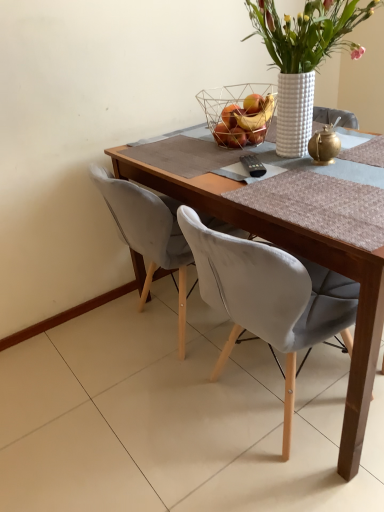
Describe the element at coordinates (238, 113) in the screenshot. I see `wire mesh basket at upper center` at that location.

You are a GUI agent. You are given a task and a screenshot of the screen. Output one action in this format:
    pyautogui.click(x=<x>, y=<y>)
    Task: Click on the white textured vase at upper center
    Image resolution: width=384 pixels, height=512 pixels.
    Given the screenshot: What is the action you would take?
    pyautogui.click(x=303, y=57)

Where is `velvet grey chair at center`? The width and height of the screenshot is (384, 512). velvet grey chair at center is located at coordinates (149, 234).

You are a GUI agent. You are given a task and a screenshot of the screen. Output one action in this format:
    pyautogui.click(x=<x>, y=<y>)
    Task: Click on the wire mesh basket at upper center
    This screenshot has width=384, height=512.
    Given the screenshot: What is the action you would take?
    pyautogui.click(x=238, y=113)

Can you tell me how much wooden table at center and velvet grey chair at center differ in facing direction?

wooden table at center and velvet grey chair at center are facing 90 degrees away from each other.

From a real-world perspective, relative to velvet grey chair at center, is wooden table at center vertically above or below?

Clearly, from a real-world perspective, wooden table at center is below velvet grey chair at center.

Would you say wooden table at center is inside or outside velvet grey chair at center?

wooden table at center is not inside velvet grey chair at center, it's outside.

Between wooden table at center and velvet grey chair at center, which one is positioned in front?

wooden table at center is in front.

Is wire mesh basket at upper center placed right next to gold metallic teapot at upper right?

No, wire mesh basket at upper center is not next to gold metallic teapot at upper right.

Between point (228, 94) and point (323, 138), which one is positioned behind?

Positioned behind is point (228, 94).

Is wire mesh basket at upper center inside the boundaries of gold metallic teapot at upper right, or outside?

wire mesh basket at upper center is outside gold metallic teapot at upper right.

Visually, is wire mesh basket at upper center positioned to the left or to the right of gold metallic teapot at upper right?

In the image, wire mesh basket at upper center appears on the left side of gold metallic teapot at upper right.

Does wire mesh basket at upper center have a greater width compared to wooden table at center?

No.

Considering the sizes of wire mesh basket at upper center and wooden table at center in the image, is wire mesh basket at upper center taller or shorter than wooden table at center?

Considering their sizes, wire mesh basket at upper center has less height than wooden table at center.

Measure the distance between wire mesh basket at upper center and wooden table at center.

wire mesh basket at upper center and wooden table at center are 19.60 inches apart from each other.

Does point (230, 130) come closer to viewer compared to point (273, 234)?

That is False.

Is gold metallic teapot at upper right shorter than velvet grey chair at center?

Indeed, gold metallic teapot at upper right has a lesser height compared to velvet grey chair at center.

Which of these two, gold metallic teapot at upper right or velvet grey chair at center, is thinner?

Thinner between the two is gold metallic teapot at upper right.

Can you tell me how much gold metallic teapot at upper right and velvet grey chair at center differ in facing direction?

84.3 degrees.

Find the location of a particular element. This screenshot has width=384, height=512. chair that is below the wire mesh basket at upper center (from the image's perspective) is located at coordinates (149, 234).

Considering the sizes of wire mesh basket at upper center and velvet grey chair at center in the image, is wire mesh basket at upper center taller or shorter than velvet grey chair at center?

In the image, wire mesh basket at upper center appears to be shorter than velvet grey chair at center.

Is wire mesh basket at upper center further to the viewer compared to velvet grey chair at center?

Yes, wire mesh basket at upper center is behind velvet grey chair at center.

Which is less distant, (198, 96) or (180, 292)?

Point (180, 292)

You are a GUI agent. You are given a task and a screenshot of the screen. Output one action in this format:
    pyautogui.click(x=<x>, y=<y>)
    Task: Click on the basket above the gold metallic teapot at upper right (from a real-world perspective)
    This screenshot has width=384, height=512.
    Given the screenshot: What is the action you would take?
    pyautogui.click(x=238, y=113)

From a real-world perspective, who is located lower, gold metallic teapot at upper right or wire mesh basket at upper center?

gold metallic teapot at upper right is physically lower.

Can you tell me how much gold metallic teapot at upper right and wire mesh basket at upper center differ in facing direction?

The facing directions of gold metallic teapot at upper right and wire mesh basket at upper center are 5.34 degrees apart.

Which is in front, point (325, 136) or point (199, 101)?

The point (325, 136) is closer to the camera.

Which of these two, white textured vase at upper center or velvet grey chair at center, stands taller?

With more height is velvet grey chair at center.

Which is in front, point (318, 37) or point (181, 283)?

The point (318, 37) is closer.

Find the location of a particular element. The image size is (384, 512). houseplant above the velvet grey chair at center (from the image's perspective) is located at coordinates (303, 57).

From the image's perspective, which is below, white textured vase at upper center or velvet grey chair at center?

velvet grey chair at center.

Locate an element on the screen. chair behind the wooden table at center is located at coordinates (149, 234).

You are a GUI agent. You are given a task and a screenshot of the screen. Output one action in this format:
    pyautogui.click(x=<x>, y=<y>)
    Task: Click on the basket above the gold metallic teapot at upper right (from the image's perspective)
    The width and height of the screenshot is (384, 512).
    Given the screenshot: What is the action you would take?
    pyautogui.click(x=238, y=113)

From the image, which object appears to be nearer to wooden table at center, velvet grey chair at center or wire mesh basket at upper center?

velvet grey chair at center lies closer to wooden table at center than the other object.

Which object lies nearer to the anchor point white textured vase at upper center, gold metallic teapot at upper right or wooden table at center?

Among the two, gold metallic teapot at upper right is located nearer to white textured vase at upper center.

Estimate the real-world distances between objects in this image. Which object is closer to wooden table at center, gold metallic teapot at upper right or wire mesh basket at upper center?

The object closer to wooden table at center is gold metallic teapot at upper right.

Looking at the image, which one is located closer to velvet grey chair at center, wooden table at center or white textured vase at upper center?

wooden table at center is positioned closer to the anchor velvet grey chair at center.

Estimate the real-world distances between objects in this image. Which object is closer to gold metallic teapot at upper right, white textured vase at upper center or wire mesh basket at upper center?

white textured vase at upper center.

Looking at the image, which one is located further to wooden table at center, wire mesh basket at upper center or velvet grey chair at center?

Based on the image, wire mesh basket at upper center appears to be further to wooden table at center.

From the image, which object appears to be nearer to white textured vase at upper center, wire mesh basket at upper center or velvet grey chair at center?

wire mesh basket at upper center lies closer to white textured vase at upper center than the other object.

Estimate the real-world distances between objects in this image. Which object is closer to white textured vase at upper center, velvet grey chair at center or wooden table at center?

The object closer to white textured vase at upper center is wooden table at center.

You are a GUI agent. You are given a task and a screenshot of the screen. Output one action in this format:
    pyautogui.click(x=<x>, y=<y>)
    Task: Click on the tea pot between white textured vase at upper center and wooden table at center vertically
    
    Given the screenshot: What is the action you would take?
    pyautogui.click(x=324, y=145)

The width and height of the screenshot is (384, 512). In order to click on basket between white textured vase at upper center and velvet grey chair at center vertically in this screenshot , I will do `click(238, 113)`.

This screenshot has width=384, height=512. Find the location of `basket between white textured vase at upper center and wooden table at center from top to bottom`. basket between white textured vase at upper center and wooden table at center from top to bottom is located at coordinates (238, 113).

Find the location of a particular element. tea pot between white textured vase at upper center and wire mesh basket at upper center from front to back is located at coordinates (324, 145).